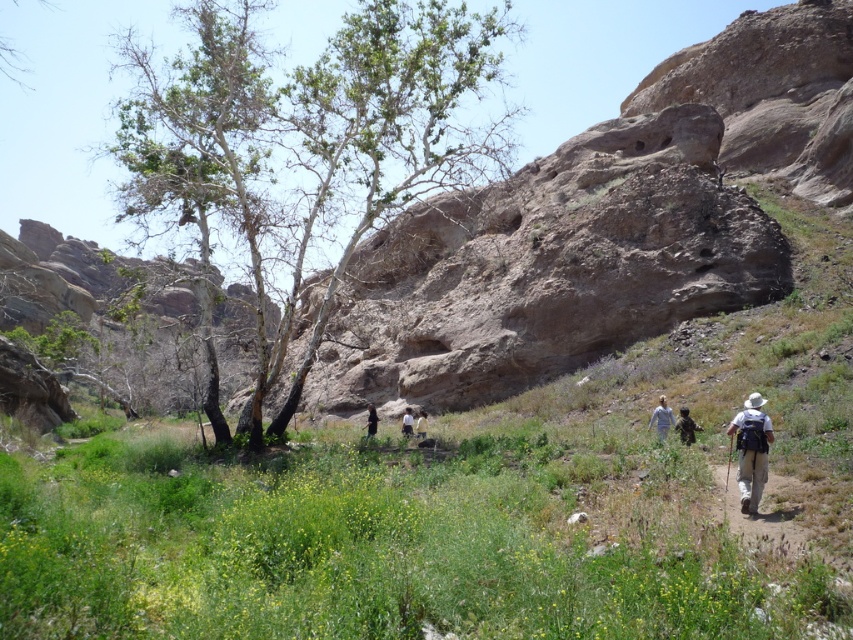
Question: Can you confirm if green leafy grass at lower center is wider than light brown leather jacket at center?

Choices:
 (A) no
 (B) yes

Answer: (B)

Question: Which point is farther from the camera taking this photo?

Choices:
 (A) (759, 470)
 (B) (94, 568)

Answer: (A)

Question: Can you confirm if khaki fabric backpack at lower right is smaller than light brown leather jacket at center?

Choices:
 (A) yes
 (B) no

Answer: (B)

Question: Which point is closer to the camera taking this photo?

Choices:
 (A) (630, 452)
 (B) (370, 403)

Answer: (A)

Question: Which point is closer to the camera taking this photo?

Choices:
 (A) (688, 413)
 (B) (366, 429)

Answer: (A)

Question: Considering the relative positions of green leafy tree at center and white cotton shirt at center in the image provided, where is green leafy tree at center located with respect to white cotton shirt at center?

Choices:
 (A) above
 (B) below

Answer: (A)